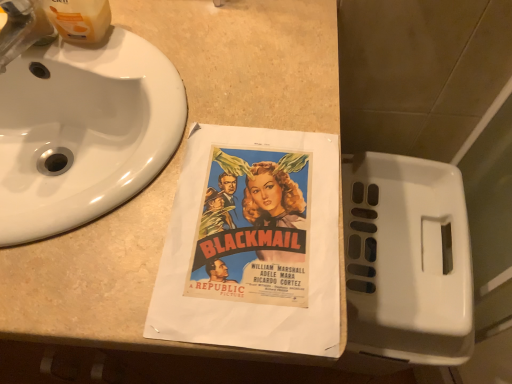
This screenshot has width=512, height=384. I want to click on free spot to the right of brushed metal faucet at upper left, so click(143, 76).